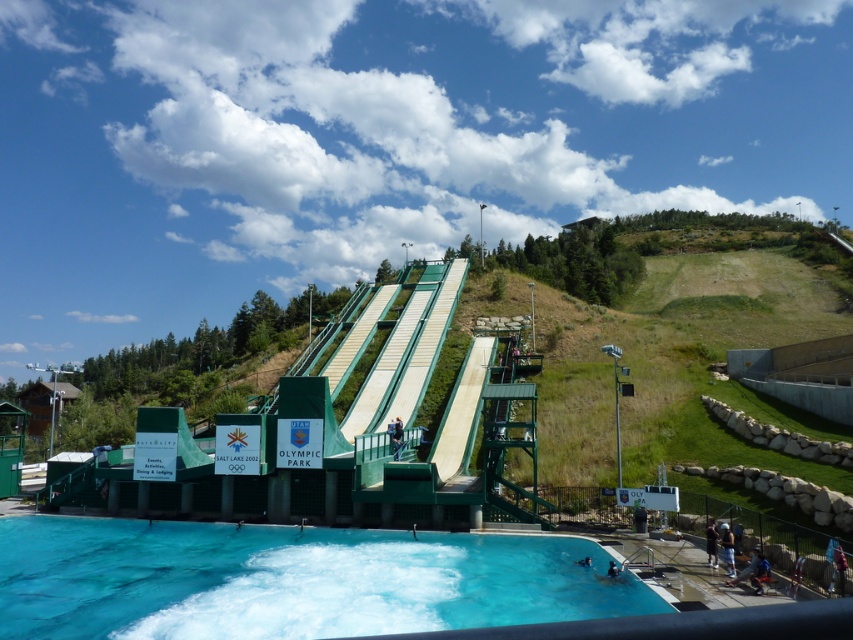
Question: Among these objects, which one is nearest to the camera?

Choices:
 (A) dark blue shirt at lower right
 (B) dark blue fabric jacket at center
 (C) green metallic diving boards at center

Answer: (C)

Question: Is clear blue water at lower left positioned in front of light blue denim shorts at lower right?

Choices:
 (A) yes
 (B) no

Answer: (A)

Question: Based on their relative distances, which object is farther from the light blue denim shorts at lower right?

Choices:
 (A) dark blue wetsuit at lower center
 (B) green metallic diving boards at center
 (C) dark blue fabric jacket at center
 (D) clear blue water at lower left

Answer: (B)

Question: Is clear blue water at lower left further to the viewer compared to dark blue wetsuit at lower center?

Choices:
 (A) no
 (B) yes

Answer: (A)

Question: Observing the image, what is the correct spatial positioning of light blue denim shorts at lower right in reference to dark blue wetsuit at lower center?

Choices:
 (A) right
 (B) left

Answer: (A)

Question: Which object is positioned farthest from the dark blue shirt at lower right?

Choices:
 (A) dark blue fabric jacket at center
 (B) dark blue wetsuit at lower center
 (C) clear blue water at lower left

Answer: (A)